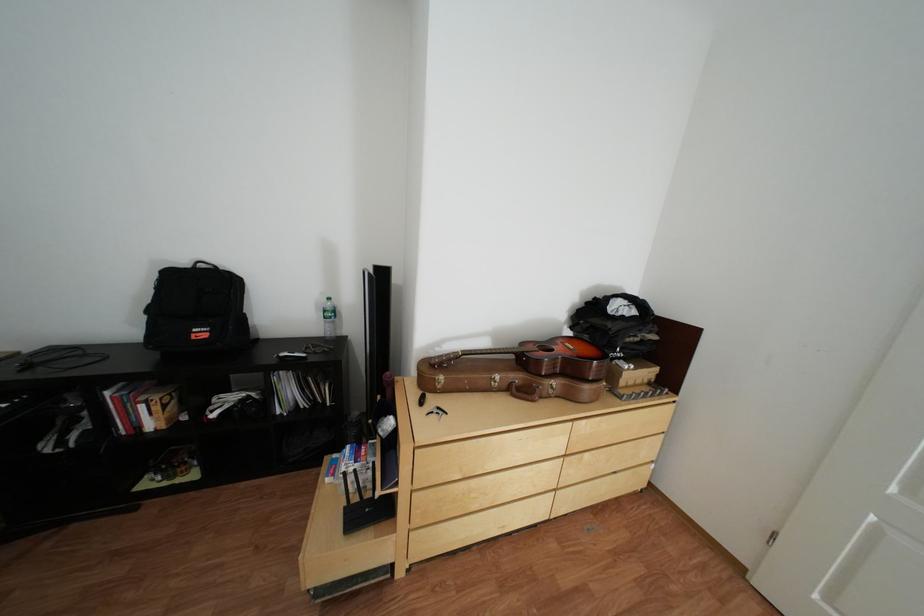
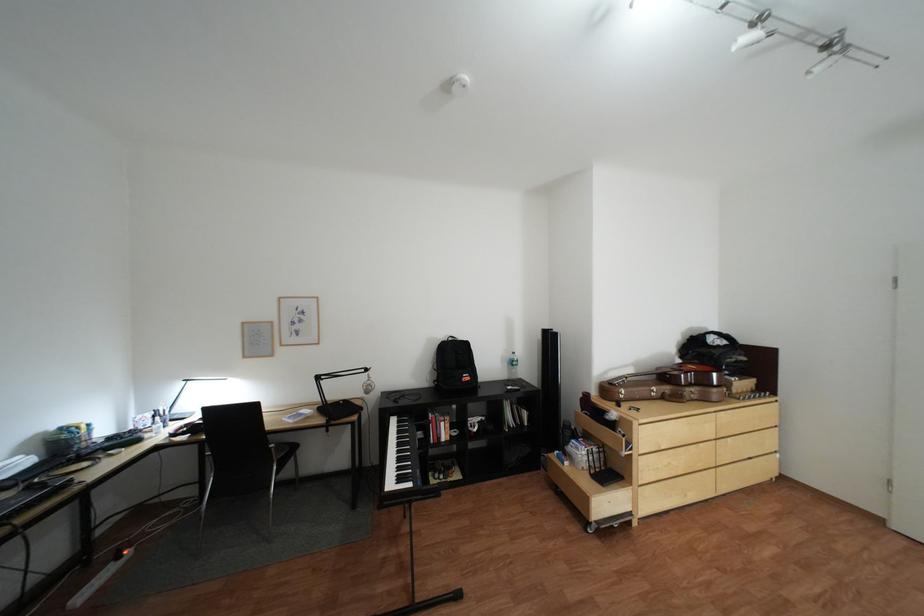
Find the pixel in the second image that matches the point at 216,265 in the first image.

(466, 339)